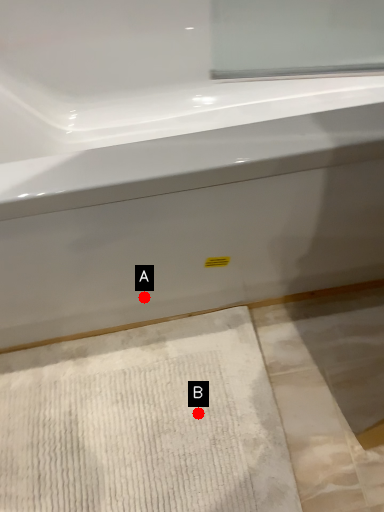
Question: Two points are circled on the image, labeled by A and B beside each circle. Which of the following is the farthest from the observer?

Choices:
 (A) A is further
 (B) B is further

Answer: (B)